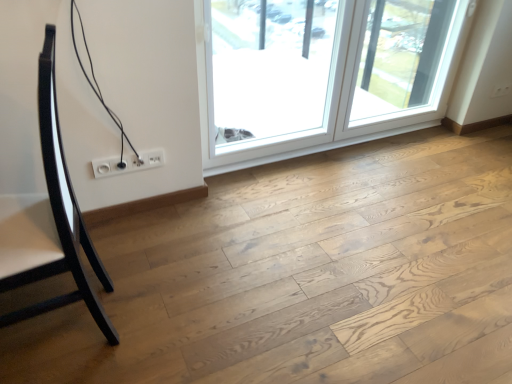
Image resolution: width=512 pixels, height=384 pixels. I want to click on free point below glossy black chair at left (from a real-world perspective), so click(49, 325).